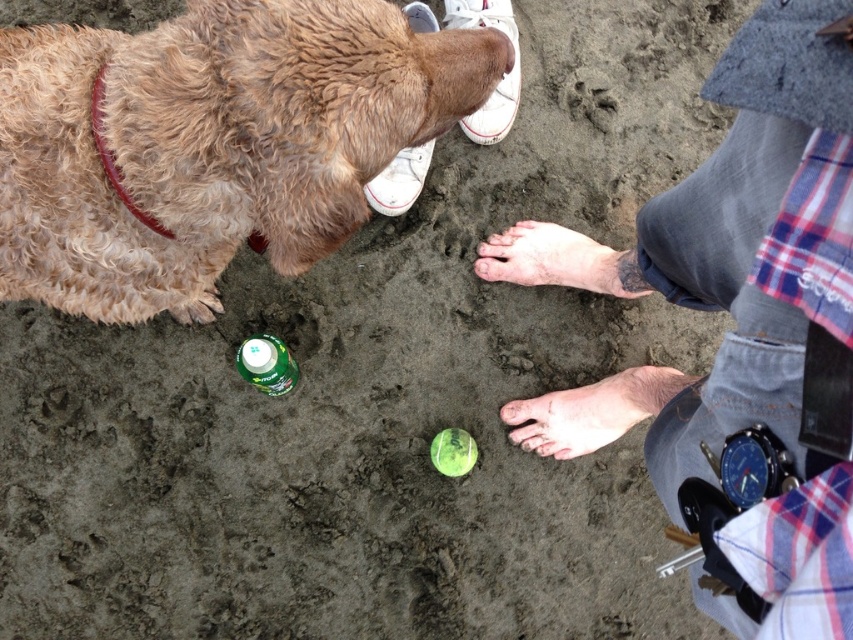
Question: Which object is the closest to the green plastic bottle at center?

Choices:
 (A) pale skin barefoot at center
 (B) skinny barefoot at lower center

Answer: (A)

Question: Which point appears closest to the camera in this image?

Choices:
 (A) (645, 404)
 (B) (218, 45)

Answer: (B)

Question: Does denim shorts at lower right have a smaller size compared to skinny barefoot at lower center?

Choices:
 (A) yes
 (B) no

Answer: (B)

Question: Which point is closer to the camera?

Choices:
 (A) pale skin barefoot at center
 (B) green plastic bottle at center
 (C) curly fur dog at upper left
 (D) brown leather collar at upper left

Answer: (C)

Question: Is pale skin barefoot at center to the left of white canvas shoe at upper center from the viewer's perspective?

Choices:
 (A) yes
 (B) no

Answer: (B)

Question: Does denim shorts at lower right lie behind white canvas shoe at upper center?

Choices:
 (A) no
 (B) yes

Answer: (A)